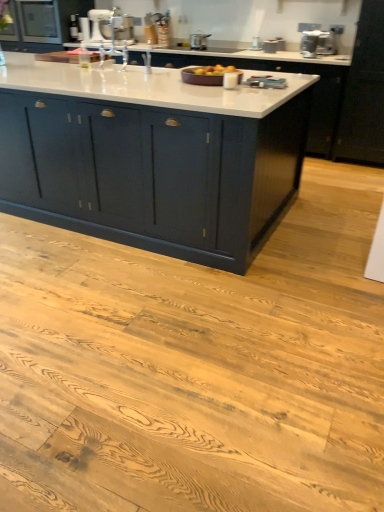
Question: From a real-world perspective, is satin silver toaster at upper right, which ranks as the second appliance in front-to-back order, positioned above or below matte dark blue cabinet at center, which is the second cabinetry in back-to-front order?

Choices:
 (A) below
 (B) above

Answer: (B)

Question: Does point (324, 31) appear closer or farther from the camera than point (33, 97)?

Choices:
 (A) farther
 (B) closer

Answer: (A)

Question: Which of these objects is positioned closest to the white glossy stand mixer at upper center, the first appliance when ordered from back to front?

Choices:
 (A) matte dark blue cabinet at center, placed as the second cabinetry when sorted from top to bottom
 (B) satin silver toaster at upper right, which ranks as the second appliance in front-to-back order
 (C) white glossy sink at upper center
 (D) matte black cabinet at upper left, marked as the 2th cabinetry in a front-to-back arrangement
 (E) metallic silver toaster at upper center, the third appliance positioned from the left

Answer: (C)

Question: Which object is the farthest from the white glossy stand mixer at upper center, which ranks as the fifth appliance in right-to-left order?

Choices:
 (A) matte black cabinet at upper left, marked as the 2th cabinetry in a front-to-back arrangement
 (B) white glossy sink at upper center
 (C) satin silver pot at upper center, positioned as the 2th appliance in left-to-right order
 (D) metallic silver toaster at upper right, marked as the 2th appliance in a right-to-left arrangement
 (E) metallic silver toaster at upper center, which ranks as the 4th appliance in front-to-back order

Answer: (D)